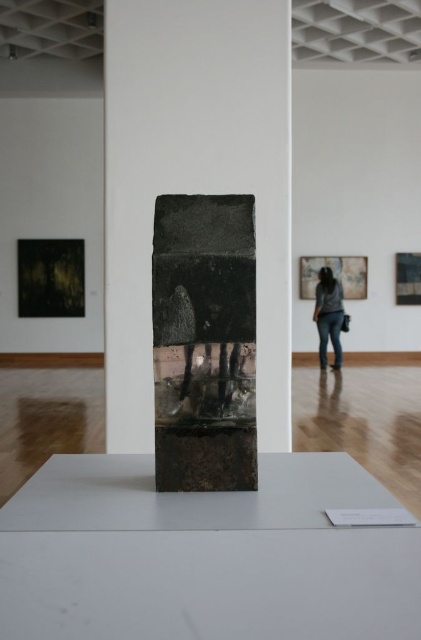
At what (x,y) coordinates should I click in order to perform the action: click on black stone sculpture at center. Please return your answer as a coordinate pair (x, y). The height and width of the screenshot is (640, 421). Looking at the image, I should click on (205, 342).

Locate an element on the screen. This screenshot has width=421, height=640. black stone sculpture at center is located at coordinates (205, 342).